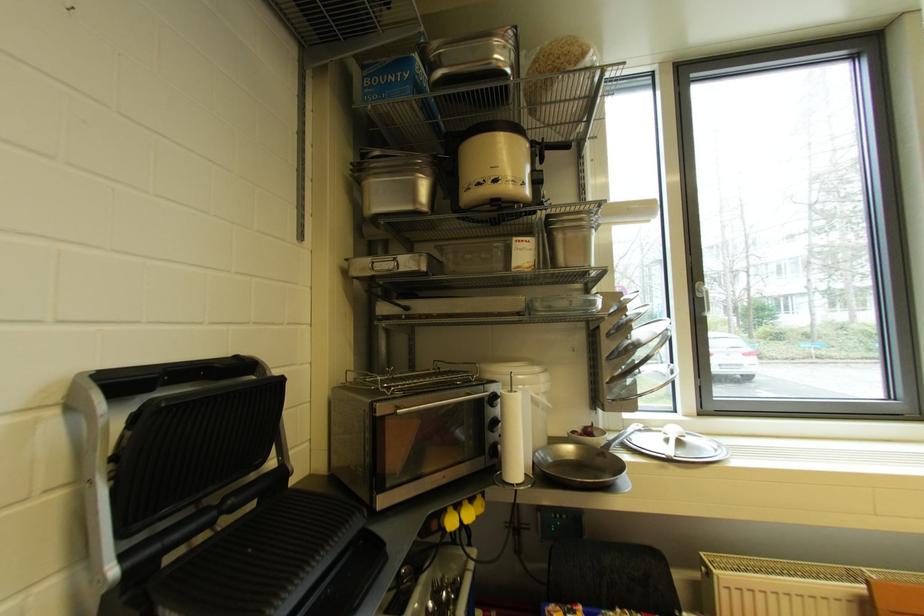
At what (x,y) coordinates should I click in order to perform the action: click on yellow plug handle. Please return your answer as a coordinate pair (x, y). Looking at the image, I should click on coord(460,515).